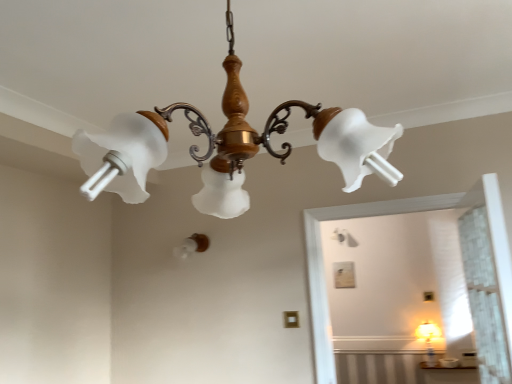
How much space does white frosted bulb at center, positioned as the 2th lamp in right-to-left order, occupy horizontally?

white frosted bulb at center, positioned as the 2th lamp in right-to-left order, is 11.77 inches in width.

Describe the element at coordinates (192, 245) in the screenshot. I see `white frosted bulb at center, placed as the second lamp when sorted from front to back` at that location.

Locate an element on the screen. The image size is (512, 384). white frosted bulb at center, the 2th lamp when ordered from top to bottom is located at coordinates (192, 245).

What is the approximate width of matte glass chandelier at upper center, acting as the 1th lamp starting from the top?

matte glass chandelier at upper center, acting as the 1th lamp starting from the top, is 55.94 centimeters wide.

Describe the element at coordinates (228, 146) in the screenshot. The width and height of the screenshot is (512, 384). I see `matte glass chandelier at upper center, the 2th lamp viewed from the left` at that location.

In order to click on matte glass chandelier at upper center, which is the second lamp in back-to-front order in this screenshot , I will do `click(228, 146)`.

Find the location of `white frosted bulb at center, positioned as the 2th lamp in right-to-left order`. white frosted bulb at center, positioned as the 2th lamp in right-to-left order is located at coordinates (192, 245).

Is matte glass chandelier at upper center, the 1th lamp when ordered from front to back, at the right side of white frosted bulb at center, positioned as the 2th lamp in right-to-left order?

Yes.

Is the position of matte glass chandelier at upper center, the 2th lamp viewed from the left, less distant than that of white frosted bulb at center, which ranks as the 1th lamp in left-to-right order?

Yes, matte glass chandelier at upper center, the 2th lamp viewed from the left, is in front of white frosted bulb at center, which ranks as the 1th lamp in left-to-right order.

Is point (148, 142) behind point (183, 241)?

No, (148, 142) is in front of (183, 241).

From the image's perspective, which is above, matte glass chandelier at upper center, which is the second lamp in back-to-front order, or white frosted bulb at center, positioned as the 2th lamp in right-to-left order?

matte glass chandelier at upper center, which is the second lamp in back-to-front order, from the image's perspective.

From a real-world perspective, who is located higher, matte glass chandelier at upper center, acting as the 1th lamp starting from the top, or white frosted bulb at center, which ranks as the 1th lamp in left-to-right order?

matte glass chandelier at upper center, acting as the 1th lamp starting from the top, is physically above.

In the scene shown: Is matte glass chandelier at upper center, which is the second lamp in back-to-front order, thinner than white frosted bulb at center, which ranks as the 1th lamp in left-to-right order?

No.

Considering the relative sizes of matte glass chandelier at upper center, acting as the 1th lamp starting from the top, and white frosted bulb at center, placed as the second lamp when sorted from front to back, in the image provided, is matte glass chandelier at upper center, acting as the 1th lamp starting from the top, taller than white frosted bulb at center, placed as the second lamp when sorted from front to back,?

Yes.

Can you confirm if matte glass chandelier at upper center, the 2th lamp viewed from the left, is bigger than white frosted bulb at center, the 2th lamp when ordered from top to bottom?

Result: Yes, matte glass chandelier at upper center, the 2th lamp viewed from the left, is bigger than white frosted bulb at center, the 2th lamp when ordered from top to bottom.

Is matte glass chandelier at upper center, marked as the second lamp in a bottom-to-top arrangement, inside the boundaries of white frosted bulb at center, the 2th lamp when ordered from top to bottom, or outside?

matte glass chandelier at upper center, marked as the second lamp in a bottom-to-top arrangement, cannot be found inside white frosted bulb at center, the 2th lamp when ordered from top to bottom.

Is matte glass chandelier at upper center, the 1th lamp when ordered from front to back, beside white frosted bulb at center, the 2th lamp when ordered from top to bottom?

matte glass chandelier at upper center, the 1th lamp when ordered from front to back, is not next to white frosted bulb at center, the 2th lamp when ordered from top to bottom, and they're not touching.

Is matte glass chandelier at upper center, the 2th lamp viewed from the left, aimed at white frosted bulb at center, positioned as the 2th lamp in right-to-left order?

No.

In the scene shown: How many degrees apart are the facing directions of matte glass chandelier at upper center, which is the second lamp in back-to-front order, and white frosted bulb at center, positioned as the 2th lamp in right-to-left order?

177 degrees separate the facing orientations of matte glass chandelier at upper center, which is the second lamp in back-to-front order, and white frosted bulb at center, positioned as the 2th lamp in right-to-left order.

Where is `lamp lying on the right of white frosted bulb at center, the 1th lamp when ordered from bottom to top`? lamp lying on the right of white frosted bulb at center, the 1th lamp when ordered from bottom to top is located at coordinates (228, 146).

Which is more to the right, white frosted bulb at center, which ranks as the 1th lamp in left-to-right order, or matte glass chandelier at upper center, which appears as the first lamp when viewed from the right?

Positioned to the right is matte glass chandelier at upper center, which appears as the first lamp when viewed from the right.

Considering their positions, is white frosted bulb at center, acting as the 1th lamp starting from the back, located in front of or behind matte glass chandelier at upper center, acting as the 1th lamp starting from the top?

Visually, white frosted bulb at center, acting as the 1th lamp starting from the back, is located behind matte glass chandelier at upper center, acting as the 1th lamp starting from the top.

Which is nearer, (x=183, y=245) or (x=239, y=64)?

The point (x=239, y=64) is more forward.

From the image's perspective, which is above, white frosted bulb at center, positioned as the 2th lamp in right-to-left order, or matte glass chandelier at upper center, the 1th lamp when ordered from front to back?

matte glass chandelier at upper center, the 1th lamp when ordered from front to back, from the image's perspective.

From a real-world perspective, between white frosted bulb at center, the 1th lamp when ordered from bottom to top, and matte glass chandelier at upper center, the 1th lamp when ordered from front to back, who is vertically lower?

white frosted bulb at center, the 1th lamp when ordered from bottom to top, is physically lower.

Considering the relative sizes of white frosted bulb at center, positioned as the 2th lamp in right-to-left order, and matte glass chandelier at upper center, marked as the second lamp in a bottom-to-top arrangement, in the image provided, is white frosted bulb at center, positioned as the 2th lamp in right-to-left order, thinner than matte glass chandelier at upper center, marked as the second lamp in a bottom-to-top arrangement,?

Indeed, white frosted bulb at center, positioned as the 2th lamp in right-to-left order, has a lesser width compared to matte glass chandelier at upper center, marked as the second lamp in a bottom-to-top arrangement.

Can you confirm if white frosted bulb at center, placed as the second lamp when sorted from front to back, is taller than matte glass chandelier at upper center, marked as the second lamp in a bottom-to-top arrangement?

Incorrect, the height of white frosted bulb at center, placed as the second lamp when sorted from front to back, is not larger of that of matte glass chandelier at upper center, marked as the second lamp in a bottom-to-top arrangement.

Considering the sizes of objects white frosted bulb at center, placed as the second lamp when sorted from front to back, and matte glass chandelier at upper center, acting as the 1th lamp starting from the top, in the image provided, who is smaller, white frosted bulb at center, placed as the second lamp when sorted from front to back, or matte glass chandelier at upper center, acting as the 1th lamp starting from the top,?

With smaller size is white frosted bulb at center, placed as the second lamp when sorted from front to back.

Is matte glass chandelier at upper center, the 2th lamp viewed from the left, located within white frosted bulb at center, the 1th lamp when ordered from bottom to top?

No, white frosted bulb at center, the 1th lamp when ordered from bottom to top, does not contain matte glass chandelier at upper center, the 2th lamp viewed from the left.

Is white frosted bulb at center, the 1th lamp when ordered from bottom to top, oriented towards matte glass chandelier at upper center, the 2th lamp viewed from the left?

No, white frosted bulb at center, the 1th lamp when ordered from bottom to top, is not aimed at matte glass chandelier at upper center, the 2th lamp viewed from the left.

How many degrees apart are the facing directions of white frosted bulb at center, the 2th lamp when ordered from top to bottom, and matte glass chandelier at upper center, the 1th lamp when ordered from front to back?

They differ by 177 degrees in their facing directions.

How much distance is there between white frosted bulb at center, placed as the second lamp when sorted from front to back, and matte glass chandelier at upper center, which appears as the first lamp when viewed from the right?

6.49 feet.

This screenshot has height=384, width=512. Identify the location of lamp behind the matte glass chandelier at upper center, the 1th lamp when ordered from front to back. (192, 245).

This screenshot has height=384, width=512. I want to click on lamp below the matte glass chandelier at upper center, the 2th lamp viewed from the left (from a real-world perspective), so click(192, 245).

Where is `lamp that appears behind the matte glass chandelier at upper center, which is the second lamp in back-to-front order`? The image size is (512, 384). lamp that appears behind the matte glass chandelier at upper center, which is the second lamp in back-to-front order is located at coordinates (192, 245).